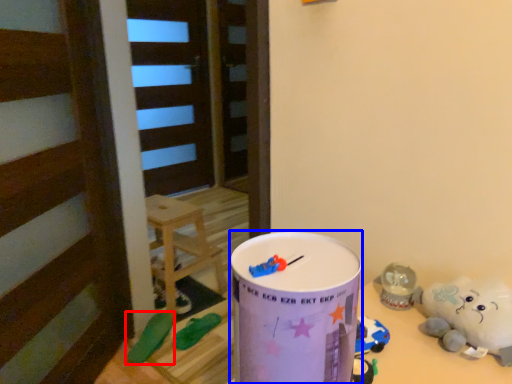
Question: Which object is closer to the camera taking this photo, toy (highlighted by a red box) or milk can (highlighted by a blue box)?

Choices:
 (A) toy
 (B) milk can

Answer: (B)